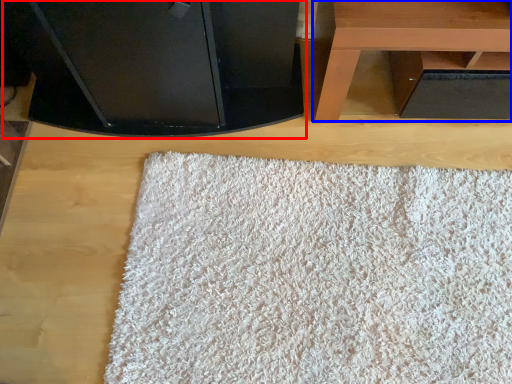
Question: Which of the following is the farthest to the observer, furniture (highlighted by a red box) or table (highlighted by a blue box)?

Choices:
 (A) furniture
 (B) table

Answer: (B)